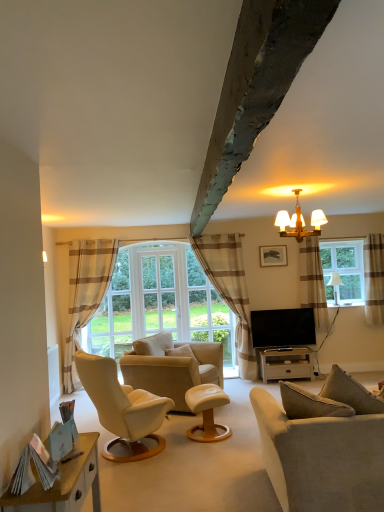
Question: Considering the positions of white wood tv stand at lower right and clear glass window at right in the image, is white wood tv stand at lower right taller or shorter than clear glass window at right?

Choices:
 (A) short
 (B) tall

Answer: (A)

Question: From the image's perspective, is white wood tv stand at lower right positioned above or below clear glass window at right?

Choices:
 (A) above
 (B) below

Answer: (B)

Question: Considering the real-world distances, which object is closest to the white wood tv stand at lower right?

Choices:
 (A) brown striped curtain at right, positioned as the 3th curtain in left-to-right order
 (B) wooden desk at lower left
 (C) wooden picture frame at upper center
 (D) white fabric lampshade at right, the 1th lamp from the bottom
 (E) brown striped curtain at center, positioned as the 2th curtain in left-to-right order

Answer: (E)

Question: Which object is the closest to the white leather stool at center?

Choices:
 (A) white glass window screen at center
 (B) wooden desk at lower left
 (C) brown striped curtain at center, positioned as the 2th curtain in left-to-right order
 (D) beige striped curtain at left, placed as the fourth curtain when sorted from right to left
 (E) white fabric lampshade at right, the 1th lamp from the bottom

Answer: (A)